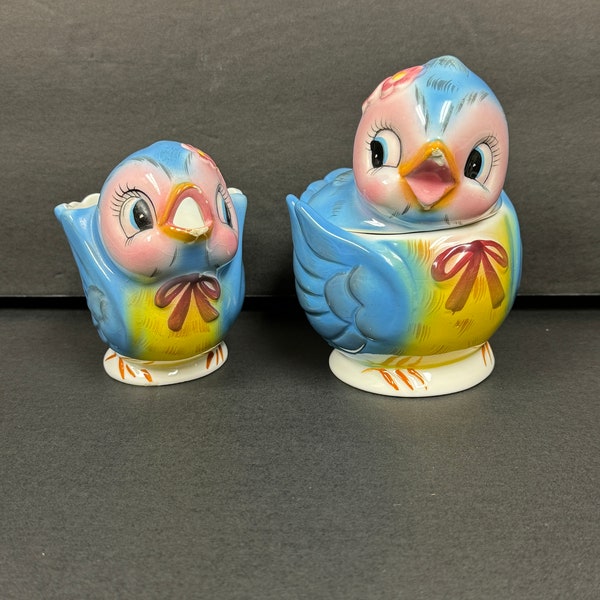
Where is `wall`? The height and width of the screenshot is (600, 600). wall is located at coordinates (236, 69).